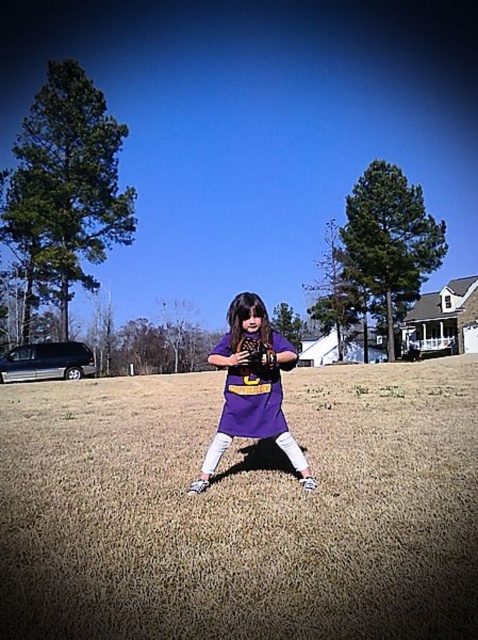
Is brown dry grass at center taller than black leather baseball glove at center?

Yes, brown dry grass at center is taller than black leather baseball glove at center.

Does brown dry grass at center have a lesser width compared to black leather baseball glove at center?

In fact, brown dry grass at center might be wider than black leather baseball glove at center.

Between point (421, 458) and point (257, 365), which one is positioned in front?

Point (257, 365)

In order to click on brown dry grass at center in this screenshot , I will do `click(241, 509)`.

Between point (358, 554) and point (232, 328), which one is positioned behind?

Positioned behind is point (232, 328).

Which is more to the left, brown dry grass at center or purple matte baseball glove at center?

brown dry grass at center

Measure the distance between point (53, 627) and camera.

Point (53, 627) and camera are 2.49 meters apart from each other.

In order to click on brown dry grass at center in this screenshot , I will do `click(241, 509)`.

Which is below, purple matte baseball glove at center or black leather baseball glove at center?

purple matte baseball glove at center is lower down.

How far apart are purple matte baseball glove at center and black leather baseball glove at center?

purple matte baseball glove at center is 15.33 inches from black leather baseball glove at center.

Where is `purple matte baseball glove at center`? purple matte baseball glove at center is located at coordinates pos(251,387).

Identify the location of purple matte baseball glove at center. (251, 387).